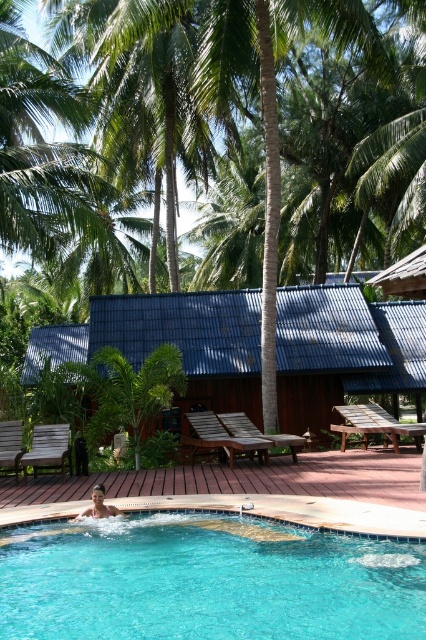
Image resolution: width=426 pixels, height=640 pixels. What do you see at coordinates (207, 580) in the screenshot? I see `blue glassy swimming pool at lower left` at bounding box center [207, 580].

Is point (155, 515) less distant than point (290, 390)?

That is True.

Is point (106, 624) positioned behind point (314, 388)?

No, (106, 624) is closer to viewer.

Locate an element on the screen. The image size is (426, 640). blue glassy swimming pool at lower left is located at coordinates (207, 580).